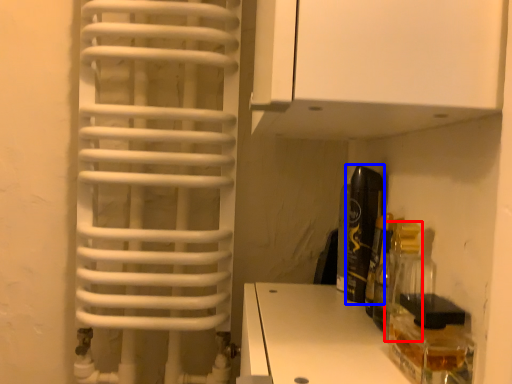
Question: Which of the following is the closest to the observer, bottle (highlighted by a red box) or bottle (highlighted by a blue box)?

Choices:
 (A) bottle
 (B) bottle

Answer: (A)